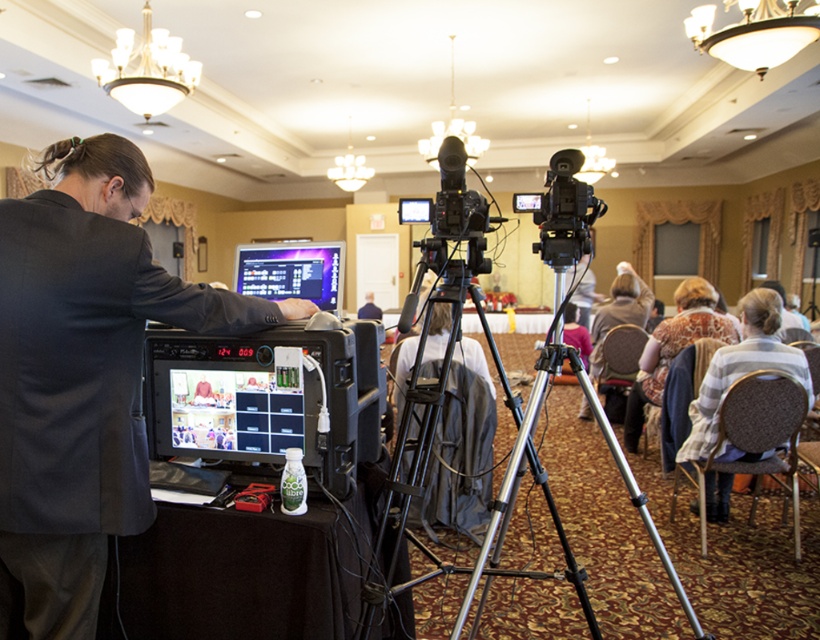
Question: Can you confirm if silver metallic tripod at center is positioned to the left of brown fabric chair at center?

Choices:
 (A) yes
 (B) no

Answer: (A)

Question: Can you confirm if silver metallic tripod at center is positioned below brown fabric chair at lower right?

Choices:
 (A) yes
 (B) no

Answer: (B)

Question: Among these points, which one is nearest to the camera?

Choices:
 (A) (165, 100)
 (B) (433, 561)

Answer: (B)

Question: Estimate the real-world distances between objects in this image. Which object is closer to the brown fabric chair at lower right?

Choices:
 (A) white glass chandelier at upper center
 (B) floral-patterned dress at center

Answer: (B)

Question: Which of the following is the closest to the observer?

Choices:
 (A) (641, 332)
 (B) (716, 324)
 (C) (73, 490)

Answer: (C)

Question: Can you confirm if brown fabric chair at center is positioned below blue fabric chair at center?

Choices:
 (A) no
 (B) yes

Answer: (B)